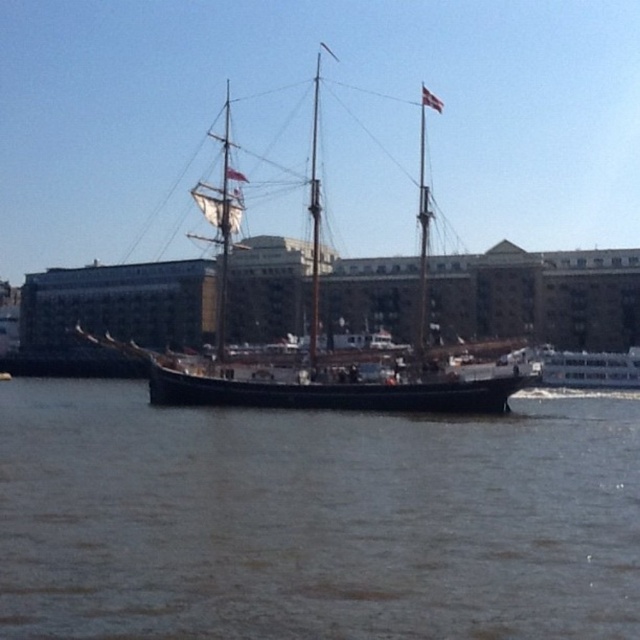
Question: Which of the following is the farthest from the observer?

Choices:
 (A) (310, 317)
 (B) (420, 164)
 (C) (253, 371)
 (D) (332, 595)

Answer: (B)

Question: Does wooden ship at center have a lesser width compared to polished wood mast at upper center?

Choices:
 (A) yes
 (B) no

Answer: (B)

Question: Is brown water at center above smooth wood mast at center?

Choices:
 (A) no
 (B) yes

Answer: (A)

Question: Can you confirm if brown water at center is positioned to the left of wooden ship at center?

Choices:
 (A) yes
 (B) no

Answer: (B)

Question: Which of these objects is positioned farthest from the smooth wood mast at center?

Choices:
 (A) wooden ship at center
 (B) polished wood mast at upper center

Answer: (B)

Question: Among these points, which one is farthest from the camera?

Choices:
 (A) 422,232
 (B) 323,360

Answer: (A)